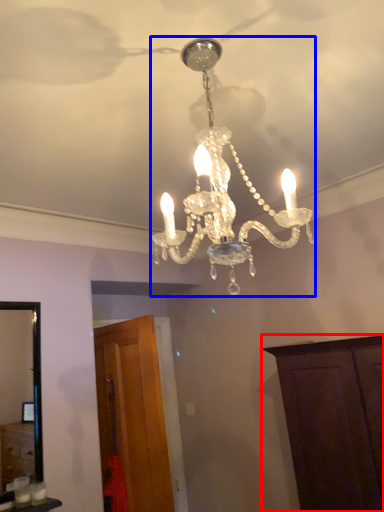
Question: Which point is further to the camera, cabinetry (highlighted by a red box) or lamp (highlighted by a blue box)?

Choices:
 (A) cabinetry
 (B) lamp

Answer: (A)